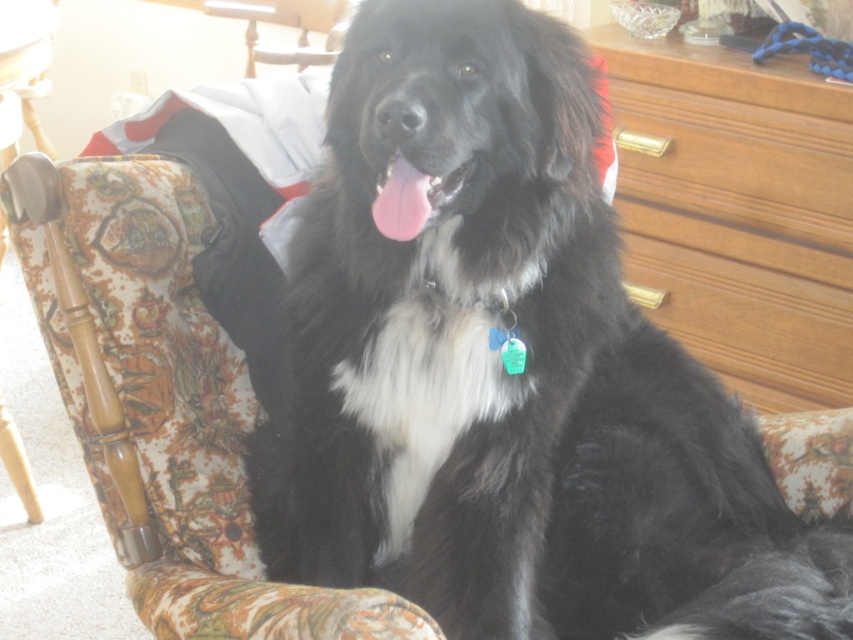
Looking at this image, who is taller, black soft fur dog at center or pink glossy tongue at center?

With more height is black soft fur dog at center.

Measure the distance between point (703, 636) and camera.

The distance of point (703, 636) from camera is 35.89 inches.

Find the location of `black soft fur dog at center`. black soft fur dog at center is located at coordinates (509, 374).

Does black soft fur dog at center have a greater height compared to wooden chair at center?

Indeed, black soft fur dog at center has a greater height compared to wooden chair at center.

Between black soft fur dog at center and wooden chair at center, which one has more height?

With more height is black soft fur dog at center.

Between point (717, 404) and point (293, 12), which one is positioned in front?

Point (717, 404) is more forward.

Where is `black soft fur dog at center`? The width and height of the screenshot is (853, 640). black soft fur dog at center is located at coordinates (509, 374).

Can you confirm if wooden at upper right is positioned above wooden chair at center?

Actually, wooden at upper right is below wooden chair at center.

Who is positioned more to the right, wooden at upper right or wooden chair at center?

wooden at upper right

Which is behind, point (628, 266) or point (276, 58)?

The point (276, 58) is behind.

This screenshot has width=853, height=640. I want to click on wooden at upper right, so click(740, 212).